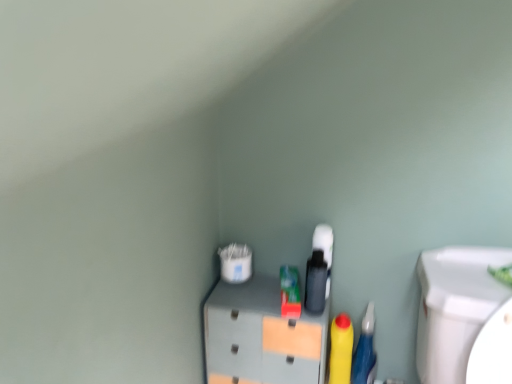
Question: Considering the relative sizes of yellow matte bottle at center and matte gray cabinet at center in the image provided, is yellow matte bottle at center shorter than matte gray cabinet at center?

Choices:
 (A) yes
 (B) no

Answer: (A)

Question: Is yellow matte bottle at center in contact with matte gray cabinet at center?

Choices:
 (A) no
 (B) yes

Answer: (A)

Question: From the image's perspective, is yellow matte bottle at center over matte gray cabinet at center?

Choices:
 (A) no
 (B) yes

Answer: (A)

Question: From a real-world perspective, is yellow matte bottle at center below matte gray cabinet at center?

Choices:
 (A) no
 (B) yes

Answer: (B)

Question: Can matte gray cabinet at center be found inside yellow matte bottle at center?

Choices:
 (A) no
 (B) yes

Answer: (A)

Question: Is matte gray cabinet at center wider or thinner than rubberized blue pen at right?

Choices:
 (A) thin
 (B) wide

Answer: (B)

Question: From the image's perspective, relative to rubberized blue pen at right, is matte gray cabinet at center above or below?

Choices:
 (A) above
 (B) below

Answer: (A)

Question: From their relative heights in the image, would you say matte gray cabinet at center is taller or shorter than rubberized blue pen at right?

Choices:
 (A) tall
 (B) short

Answer: (A)

Question: In the image, is matte gray cabinet at center on the left side or the right side of rubberized blue pen at right?

Choices:
 (A) left
 (B) right

Answer: (A)

Question: From the image's perspective, is yellow matte bottle at center above or below rubberized blue pen at right?

Choices:
 (A) below
 (B) above

Answer: (B)

Question: Based on their sizes in the image, would you say yellow matte bottle at center is bigger or smaller than rubberized blue pen at right?

Choices:
 (A) small
 (B) big

Answer: (A)

Question: Does point (348, 365) appear closer or farther from the camera than point (372, 349)?

Choices:
 (A) farther
 (B) closer

Answer: (A)

Question: Is yellow matte bottle at center in front of or behind rubberized blue pen at right in the image?

Choices:
 (A) behind
 (B) front

Answer: (A)

Question: From the image's perspective, relative to yellow matte bottle at center, is rubberized blue pen at right above or below?

Choices:
 (A) below
 (B) above

Answer: (A)

Question: Looking at their shapes, would you say rubberized blue pen at right is wider or thinner than yellow matte bottle at center?

Choices:
 (A) thin
 (B) wide

Answer: (B)